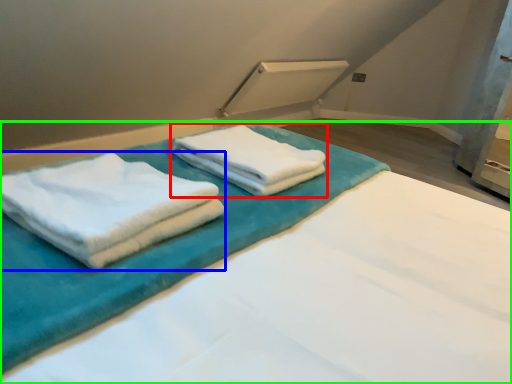
Question: Which is nearer to the towel (highlighted by a red box)? towel (highlighted by a blue box) or bed (highlighted by a green box).

Choices:
 (A) towel
 (B) bed

Answer: (B)